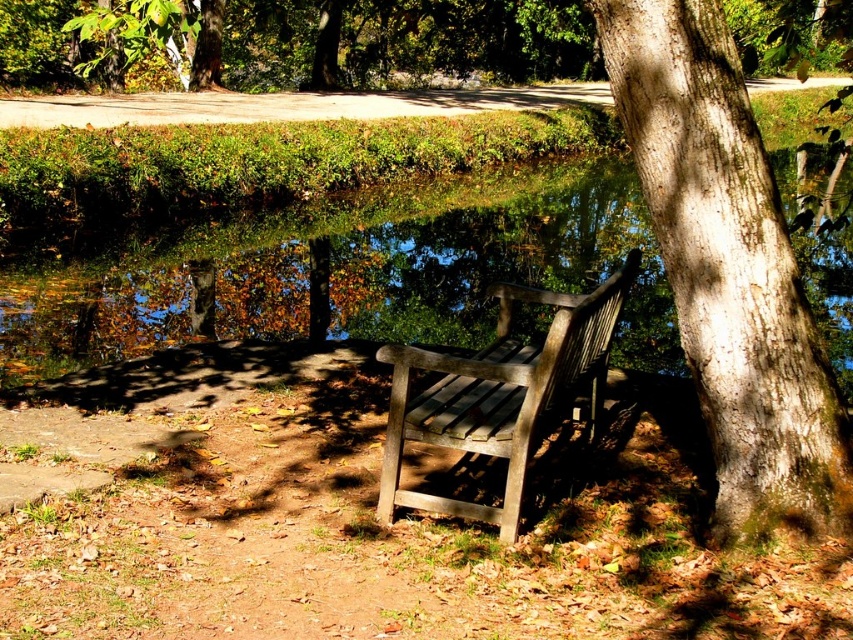
Question: Can you confirm if green reflective water at center is thinner than smooth bark tree at center?

Choices:
 (A) yes
 (B) no

Answer: (B)

Question: Is green reflective water at center to the left of smooth bark tree at center from the viewer's perspective?

Choices:
 (A) no
 (B) yes

Answer: (A)

Question: Can you confirm if green reflective water at center is bigger than wooden park bench at center?

Choices:
 (A) no
 (B) yes

Answer: (B)

Question: Which is nearer to the green reflective water at center?

Choices:
 (A) smooth bark tree at center
 (B) wooden park bench at center

Answer: (B)

Question: Estimate the real-world distances between objects in this image. Which object is farther from the wooden park bench at center?

Choices:
 (A) smooth bark tree at center
 (B) green reflective water at center

Answer: (B)

Question: Which point is closer to the camera?

Choices:
 (A) smooth bark tree at center
 (B) wooden park bench at center

Answer: (A)